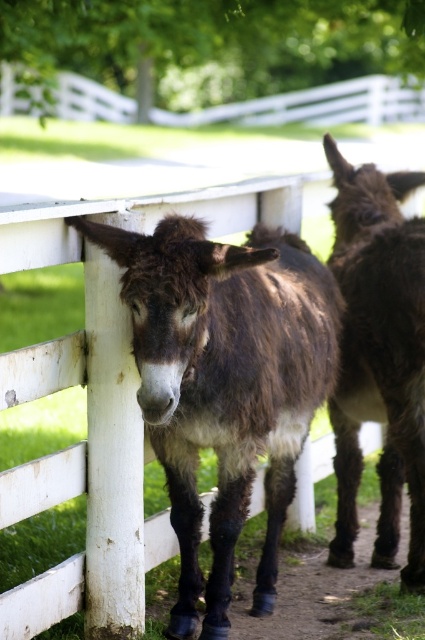
Can you confirm if brown fuzzy mule at center is thinner than white wooden rail at upper center?

Correct, brown fuzzy mule at center's width is less than white wooden rail at upper center's.

Which is more to the right, brown fuzzy mule at center or white wooden rail at upper center?

brown fuzzy mule at center is more to the right.

Between point (354, 284) and point (283, 113), which one is positioned behind?

Positioned behind is point (283, 113).

Image resolution: width=425 pixels, height=640 pixels. Find the location of `brown fuzzy mule at center`. brown fuzzy mule at center is located at coordinates click(x=379, y=356).

Can you confirm if brown fuzzy donkey at center is taller than brown fuzzy mule at center?

No.

From the picture: Can you confirm if brown fuzzy donkey at center is positioned to the right of brown fuzzy mule at center?

In fact, brown fuzzy donkey at center is to the left of brown fuzzy mule at center.

Is point (181, 282) closer to viewer compared to point (387, 355)?

Yes, point (181, 282) is closer to viewer.

Locate an element on the screen. brown fuzzy donkey at center is located at coordinates (224, 381).

Looking at this image, is brown fuzzy donkey at center below white wooden rail at upper center?

Indeed, brown fuzzy donkey at center is positioned under white wooden rail at upper center.

The height and width of the screenshot is (640, 425). What are the coordinates of `brown fuzzy donkey at center` in the screenshot? It's located at (224, 381).